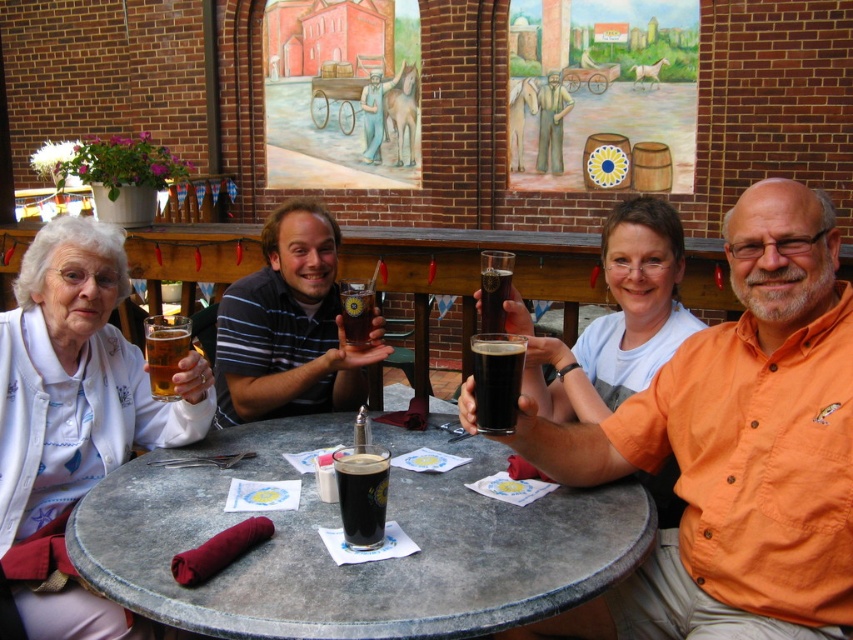
In the scene shown: Who is positioned more to the left, orange shirt at center or dark matte glass at center?

dark matte glass at center

Measure the distance between point (782, 560) and camera.

The distance of point (782, 560) from camera is 5.02 feet.

Is point (799, 218) closer to camera compared to point (368, 548)?

No, (799, 218) is behind (368, 548).

Find the location of a particular element. orange shirt at center is located at coordinates (734, 449).

Between dark glass at center and dark glass beer at center, which one is positioned higher?

dark glass beer at center is above.

Is dark glass at center thinner than dark glass beer at center?

In fact, dark glass at center might be wider than dark glass beer at center.

Does point (494, 406) come behind point (483, 291)?

No, (494, 406) is closer to viewer.

The height and width of the screenshot is (640, 853). Find the location of `dark glass at center`. dark glass at center is located at coordinates (496, 380).

Is point (62, 328) positioned before point (238, 360)?

Yes.

Is matte white blouse at left behind striped cotton shirt at center?

No.

This screenshot has width=853, height=640. What do you see at coordinates (77, 378) in the screenshot?
I see `matte white blouse at left` at bounding box center [77, 378].

This screenshot has height=640, width=853. In order to click on matte white blouse at left in this screenshot , I will do `click(77, 378)`.